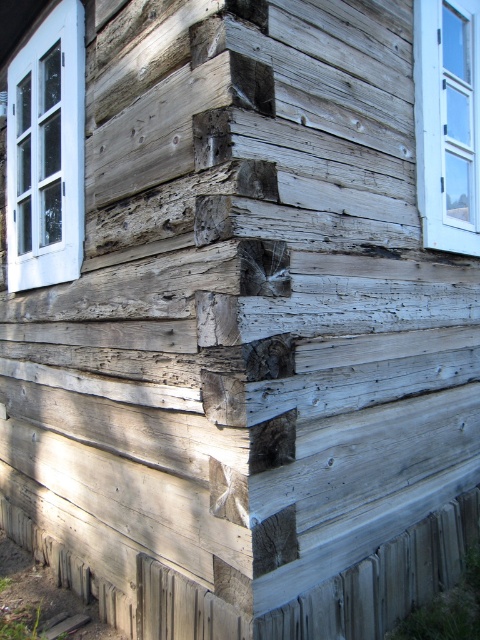
Looking at this image, you are standing at the front entrance of the rustic wooden building and want to locate the white wooden window at upper left. Based on its coordinates, can you determine if it is positioned closer to the top or bottom of the building?

The white wooden window at upper left is positioned at coordinates point (46, 152). Since the y coordinate is 0.096, which is closer to 0, it is positioned closer to the top of the building.

In the scene shown: You are standing in front of a rustic wooden building and see two white windows. One is the white wooden window at upper left and the other is the white wood window at upper right. Which window is located to the left of the other?

The white wooden window at upper left is positioned on the left side of the white wood window at upper right.